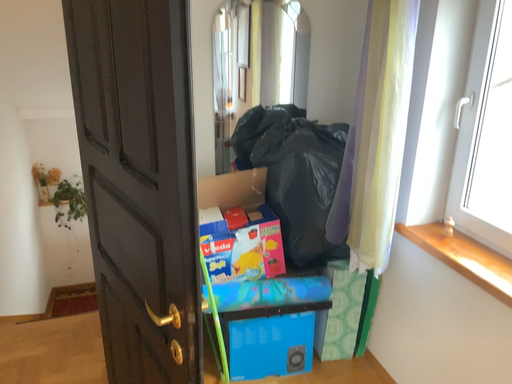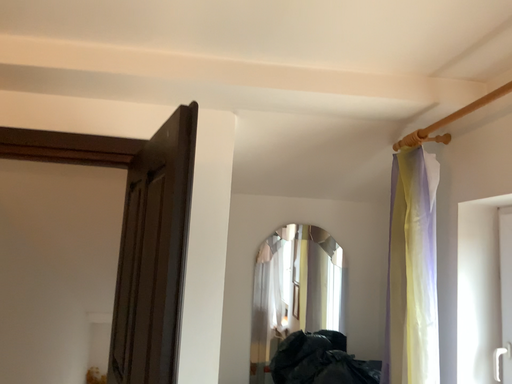
Question: How did the camera likely rotate when shooting the video?

Choices:
 (A) rotated downward
 (B) rotated upward

Answer: (B)